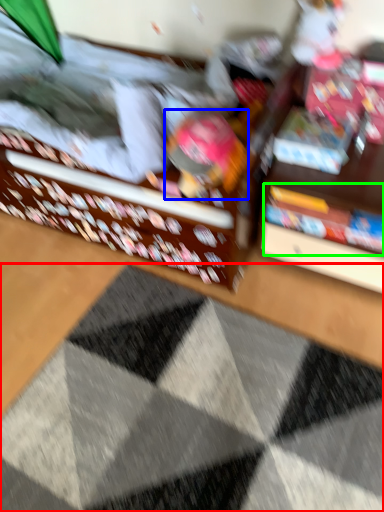
Question: Based on their relative distances, which object is nearer to doormat (highlighted by a red box)? Choose from toy (highlighted by a blue box) and book (highlighted by a green box).

Choices:
 (A) toy
 (B) book

Answer: (B)